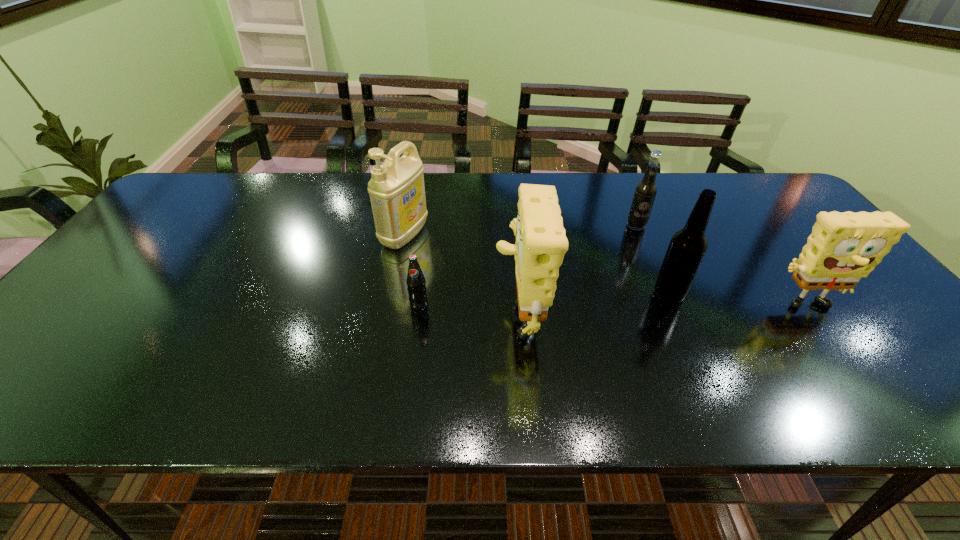
The image size is (960, 540). What are the coordinates of `vacant space positioned 0.370m on the face of the taller sponge` in the screenshot? It's located at (337, 312).

You are a GUI agent. You are given a task and a screenshot of the screen. Output one action in this format:
    pyautogui.click(x=<x>, y=<y>)
    Task: Click on the vacant area situated 0.080m on the face of the rightmost object
    The image size is (960, 540).
    Given the screenshot: What is the action you would take?
    pyautogui.click(x=832, y=350)

The width and height of the screenshot is (960, 540). Find the location of `vacant region located 0.390m on the label of the root beer`. vacant region located 0.390m on the label of the root beer is located at coordinates (684, 337).

This screenshot has height=540, width=960. I want to click on free region located on the left of the detergent, so 325,235.

Where is `free point located on the front label of the pop`? The height and width of the screenshot is (540, 960). free point located on the front label of the pop is located at coordinates (415, 334).

Where is `vacant space located on the right of the beer bottle`? vacant space located on the right of the beer bottle is located at coordinates (766, 294).

Locate an element on the screen. The height and width of the screenshot is (540, 960). object present at the near edge is located at coordinates (541, 242).

You are a GUI agent. You are given a task and a screenshot of the screen. Output one action in this format:
    pyautogui.click(x=<x>, y=<y>)
    Task: Click on the object located at the right edge
    The height and width of the screenshot is (540, 960).
    Given the screenshot: What is the action you would take?
    pyautogui.click(x=843, y=247)

Where is `vacant space at the far edge`? The image size is (960, 540). vacant space at the far edge is located at coordinates (462, 196).

Locate an element on the screen. free spot at the near edge of the desktop is located at coordinates (384, 368).